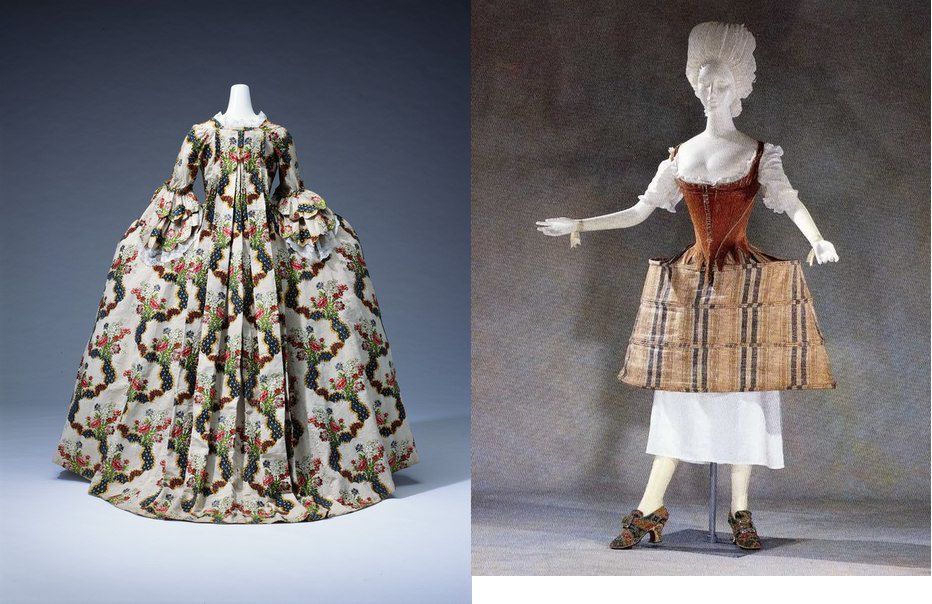
This screenshot has height=604, width=932. Find the location of `headless mannequin`. headless mannequin is located at coordinates (243, 101).